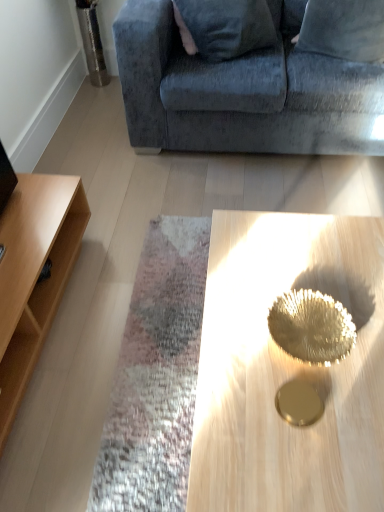
You are a GUI agent. You are given a task and a screenshot of the screen. Output one action in this format:
    pyautogui.click(x=<x>, y=<y>)
    Task: Click on the free point above gold metallic tray at center (from a real-world perspective)
    
    Given the screenshot: What is the action you would take?
    pyautogui.click(x=283, y=382)